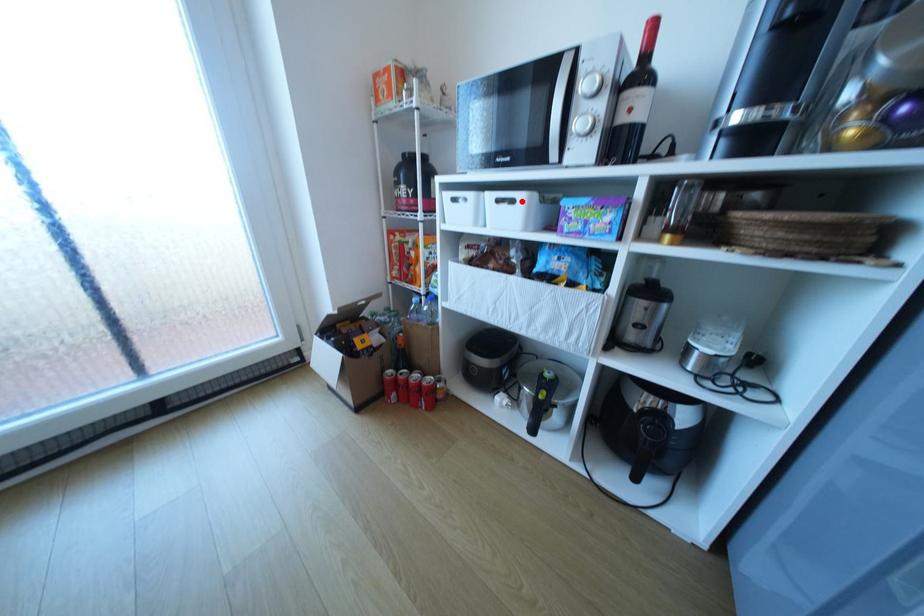
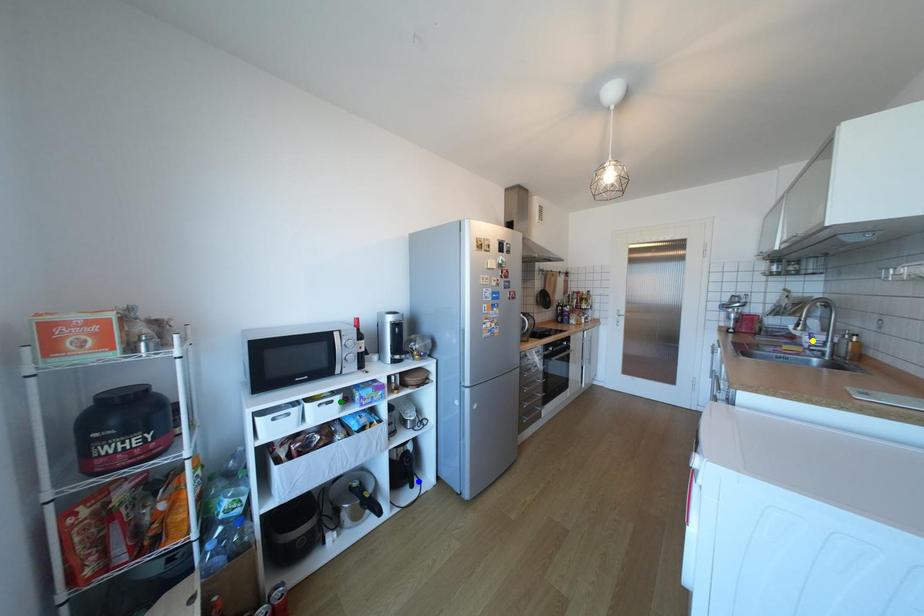
Question: I am providing you with two images of the same scene from different viewpoints. A red point is marked on the first image. You are given multiple points on the second image. Which spot in image 2 lines up with the point in image 1?

Choices:
 (A) green point
 (B) yellow point
 (C) blue point

Answer: (A)